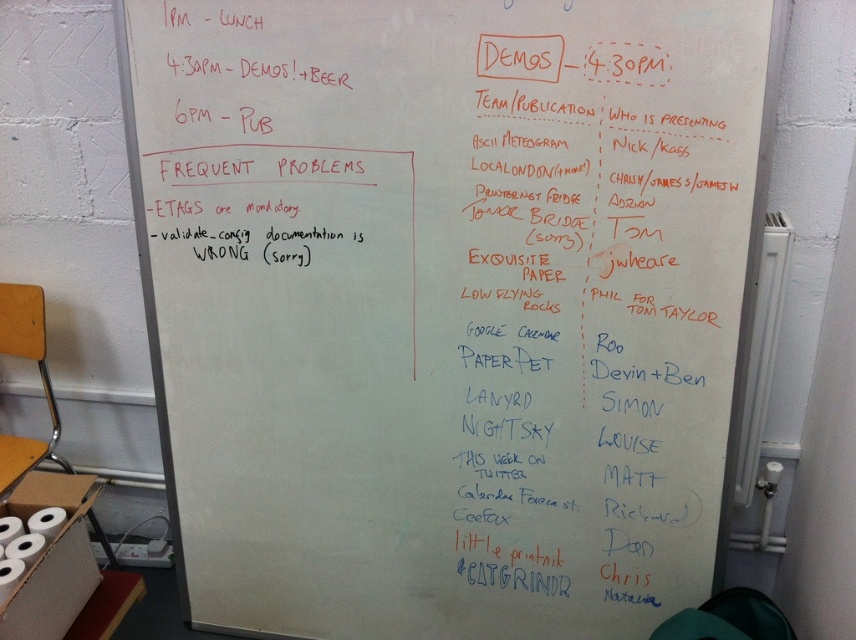
Question: Can you confirm if orange marker text at upper center is smaller than white matte toilet paper at lower left?

Choices:
 (A) yes
 (B) no

Answer: (A)

Question: Can you confirm if orange marker text at upper center is thinner than white matte toilet paper at lower left?

Choices:
 (A) no
 (B) yes

Answer: (A)

Question: Which point is farther to the camera?

Choices:
 (A) orange marker text at upper center
 (B) white matte toilet paper at lower left

Answer: (B)

Question: Which of the following is the farthest from the observer?

Choices:
 (A) coord(507,72)
 (B) coord(52,528)

Answer: (B)

Question: Is the position of orange marker text at upper center more distant than that of white matte toilet paper at lower left?

Choices:
 (A) no
 (B) yes

Answer: (A)